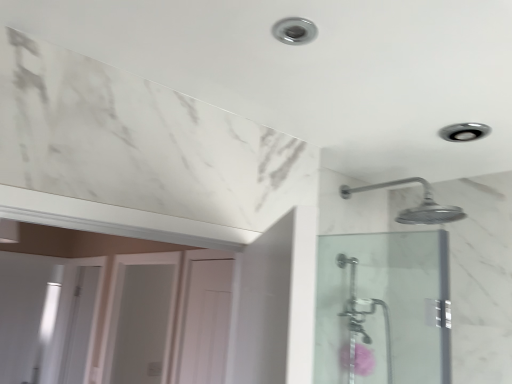
Describe the element at coordinates (141, 318) in the screenshot. I see `white glossy door at center, the second screen door positioned from the back` at that location.

This screenshot has width=512, height=384. What are the coordinates of `clear glass shower door at right, which is the first screen door in right-to-left order` in the screenshot? It's located at (383, 308).

I want to click on flower located in front of the white glossy screen door at lower left, the first screen door from the back, so click(362, 360).

What's the angular difference between pink fluffy flower at lower right and white glossy screen door at lower left, the 3th screen door viewed from the front,'s facing directions?

The angular difference between pink fluffy flower at lower right and white glossy screen door at lower left, the 3th screen door viewed from the front, is 1 degrees.

Can you confirm if pink fluffy flower at lower right is positioned to the left of white glossy screen door at lower left, which ranks as the 3th screen door in right-to-left order?

No.

In terms of width, does pink fluffy flower at lower right look wider or thinner when compared to white glossy screen door at lower left, which ranks as the first screen door in left-to-right order?

Clearly, pink fluffy flower at lower right has more width compared to white glossy screen door at lower left, which ranks as the first screen door in left-to-right order.

You are a GUI agent. You are given a task and a screenshot of the screen. Output one action in this format:
    pyautogui.click(x=<x>, y=<y>)
    Task: Click on the 1st screen door positioned below the pink fluffy flower at lower right (from the image's perspective)
    
    Given the screenshot: What is the action you would take?
    pyautogui.click(x=141, y=318)

Does white glossy door at center, marked as the 2th screen door in a left-to-right arrangement, have a lesser height compared to pink fluffy flower at lower right?

In fact, white glossy door at center, marked as the 2th screen door in a left-to-right arrangement, may be taller than pink fluffy flower at lower right.

Is point (119, 359) in front of point (355, 368)?

That is False.

From a real-world perspective, is white glossy door at center, marked as the second screen door in a right-to-left arrangement, physically above pink fluffy flower at lower right?

No, from a real-world perspective, white glossy door at center, marked as the second screen door in a right-to-left arrangement, is not on top of pink fluffy flower at lower right.

Considering the positions of points (71, 313) and (173, 279), is point (71, 313) closer to camera compared to point (173, 279)?

No, it is behind (173, 279).

Is white glossy screen door at lower left, the first screen door from the back, closer to camera compared to white glossy door at center, the second screen door positioned from the back?

No, white glossy screen door at lower left, the first screen door from the back, is further to the viewer.

Is white glossy screen door at lower left, the 3th screen door viewed from the front, oriented away from white glossy door at center, marked as the second screen door in a right-to-left arrangement?

white glossy screen door at lower left, the 3th screen door viewed from the front, does not have its back to white glossy door at center, marked as the second screen door in a right-to-left arrangement.

Is pink fluffy flower at lower right positioned with its back to clear glass shower door at right, the first screen door positioned from the front?

No, pink fluffy flower at lower right's orientation is not away from clear glass shower door at right, the first screen door positioned from the front.

In the scene shown: Is pink fluffy flower at lower right located outside clear glass shower door at right, arranged as the 3th screen door when viewed from the left?

→ Yes, pink fluffy flower at lower right is outside of clear glass shower door at right, arranged as the 3th screen door when viewed from the left.

Considering the relative positions of pink fluffy flower at lower right and clear glass shower door at right, which is the first screen door in right-to-left order, in the image provided, is pink fluffy flower at lower right behind clear glass shower door at right, which is the first screen door in right-to-left order,?

Yes.

Which of these two, pink fluffy flower at lower right or clear glass shower door at right, arranged as the 3th screen door when viewed from the left, stands taller?

Standing taller between the two is clear glass shower door at right, arranged as the 3th screen door when viewed from the left.

Is point (78, 327) less distant than point (344, 361)?

No.

Considering the relative sizes of white glossy screen door at lower left, the first screen door from the back, and pink fluffy flower at lower right in the image provided, is white glossy screen door at lower left, the first screen door from the back, taller than pink fluffy flower at lower right?

Yes, white glossy screen door at lower left, the first screen door from the back, is taller than pink fluffy flower at lower right.

Who is taller, white glossy door at center, marked as the second screen door in a right-to-left arrangement, or clear glass shower door at right, which is the first screen door in right-to-left order?

Standing taller between the two is white glossy door at center, marked as the second screen door in a right-to-left arrangement.

Measure the distance from white glossy door at center, marked as the 2th screen door in a left-to-right arrangement, to clear glass shower door at right, which is the first screen door in right-to-left order.

white glossy door at center, marked as the 2th screen door in a left-to-right arrangement, is 4.24 feet from clear glass shower door at right, which is the first screen door in right-to-left order.

Is white glossy door at center, marked as the 2th screen door in a left-to-right arrangement, spatially inside clear glass shower door at right, placed as the 3th screen door when sorted from back to front, or outside of it?

white glossy door at center, marked as the 2th screen door in a left-to-right arrangement, cannot be found inside clear glass shower door at right, placed as the 3th screen door when sorted from back to front.

In terms of size, does white glossy door at center, the second screen door positioned from the back, appear bigger or smaller than clear glass shower door at right, placed as the 3th screen door when sorted from back to front?

white glossy door at center, the second screen door positioned from the back, is bigger than clear glass shower door at right, placed as the 3th screen door when sorted from back to front.

What's the angular difference between clear glass shower door at right, the first screen door positioned from the front, and white glossy screen door at lower left, which ranks as the first screen door in left-to-right order,'s facing directions?

88.9 degrees separate the facing orientations of clear glass shower door at right, the first screen door positioned from the front, and white glossy screen door at lower left, which ranks as the first screen door in left-to-right order.

From the picture: From the image's perspective, which object appears higher, clear glass shower door at right, the first screen door positioned from the front, or white glossy screen door at lower left, the first screen door from the back?

clear glass shower door at right, the first screen door positioned from the front, is shown above in the image.

Is clear glass shower door at right, arranged as the 3th screen door when viewed from the left, positioned in front of white glossy screen door at lower left, the first screen door from the back?

That is True.

Is point (431, 241) farther from viewer compared to point (82, 307)?

No, it is not.

Identify the location of flower located above the white glossy screen door at lower left, the 3th screen door viewed from the front (from a real-world perspective). This screenshot has height=384, width=512. (362, 360).

At what (x,y) coordinates should I click in order to perform the action: click on screen door that is the 1st one when counting backward from the pink fluffy flower at lower right. Please return your answer as a coordinate pair (x, y). Looking at the image, I should click on (141, 318).

Based on their spatial positions, is white glossy door at center, which is counted as the 2th screen door, starting from the front, or pink fluffy flower at lower right further from clear glass shower door at right, arranged as the 3th screen door when viewed from the left?

white glossy door at center, which is counted as the 2th screen door, starting from the front, is positioned further to the anchor clear glass shower door at right, arranged as the 3th screen door when viewed from the left.

Based on their spatial positions, is pink fluffy flower at lower right or white glossy screen door at lower left, which ranks as the first screen door in left-to-right order, further from clear glass shower door at right, the first screen door positioned from the front?

white glossy screen door at lower left, which ranks as the first screen door in left-to-right order.

Considering their positions, is white glossy screen door at lower left, which ranks as the 3th screen door in right-to-left order, positioned closer to pink fluffy flower at lower right than clear glass shower door at right, the first screen door positioned from the front?

clear glass shower door at right, the first screen door positioned from the front, lies closer to pink fluffy flower at lower right than the other object.

Looking at the image, which one is located closer to white glossy door at center, which is counted as the 2th screen door, starting from the front, white glossy screen door at lower left, which ranks as the first screen door in left-to-right order, or clear glass shower door at right, which is the first screen door in right-to-left order?

Based on the image, white glossy screen door at lower left, which ranks as the first screen door in left-to-right order, appears to be nearer to white glossy door at center, which is counted as the 2th screen door, starting from the front.

When comparing their distances from white glossy door at center, marked as the second screen door in a right-to-left arrangement, does white glossy screen door at lower left, which ranks as the 3th screen door in right-to-left order, or pink fluffy flower at lower right seem further?

Based on the image, pink fluffy flower at lower right appears to be further to white glossy door at center, marked as the second screen door in a right-to-left arrangement.

From the image, which object appears to be nearer to pink fluffy flower at lower right, clear glass shower door at right, which is the first screen door in right-to-left order, or white glossy screen door at lower left, which ranks as the first screen door in left-to-right order?

clear glass shower door at right, which is the first screen door in right-to-left order.

Based on their spatial positions, is clear glass shower door at right, which is the first screen door in right-to-left order, or pink fluffy flower at lower right closer to white glossy door at center, which is counted as the 2th screen door, starting from the front?

Based on the image, clear glass shower door at right, which is the first screen door in right-to-left order, appears to be nearer to white glossy door at center, which is counted as the 2th screen door, starting from the front.

From the image, which object appears to be farther from white glossy screen door at lower left, which ranks as the first screen door in left-to-right order, clear glass shower door at right, placed as the 3th screen door when sorted from back to front, or pink fluffy flower at lower right?

Based on the image, pink fluffy flower at lower right appears to be further to white glossy screen door at lower left, which ranks as the first screen door in left-to-right order.

Where is `screen door between white glossy door at center, marked as the second screen door in a right-to-left arrangement, and pink fluffy flower at lower right, in the horizontal direction`? The height and width of the screenshot is (384, 512). screen door between white glossy door at center, marked as the second screen door in a right-to-left arrangement, and pink fluffy flower at lower right, in the horizontal direction is located at coordinates (383, 308).

This screenshot has width=512, height=384. Find the location of `screen door between pink fluffy flower at lower right and white glossy screen door at lower left, the first screen door from the back, along the z-axis`. screen door between pink fluffy flower at lower right and white glossy screen door at lower left, the first screen door from the back, along the z-axis is located at coordinates (141, 318).

The height and width of the screenshot is (384, 512). What are the coordinates of `screen door between clear glass shower door at right, the first screen door positioned from the front, and white glossy screen door at lower left, the 3th screen door viewed from the front, from front to back` in the screenshot? It's located at (141, 318).

Where is `flower between clear glass shower door at right, the first screen door positioned from the front, and white glossy screen door at lower left, which ranks as the 3th screen door in right-to-left order, along the z-axis`? The image size is (512, 384). flower between clear glass shower door at right, the first screen door positioned from the front, and white glossy screen door at lower left, which ranks as the 3th screen door in right-to-left order, along the z-axis is located at coordinates (362, 360).